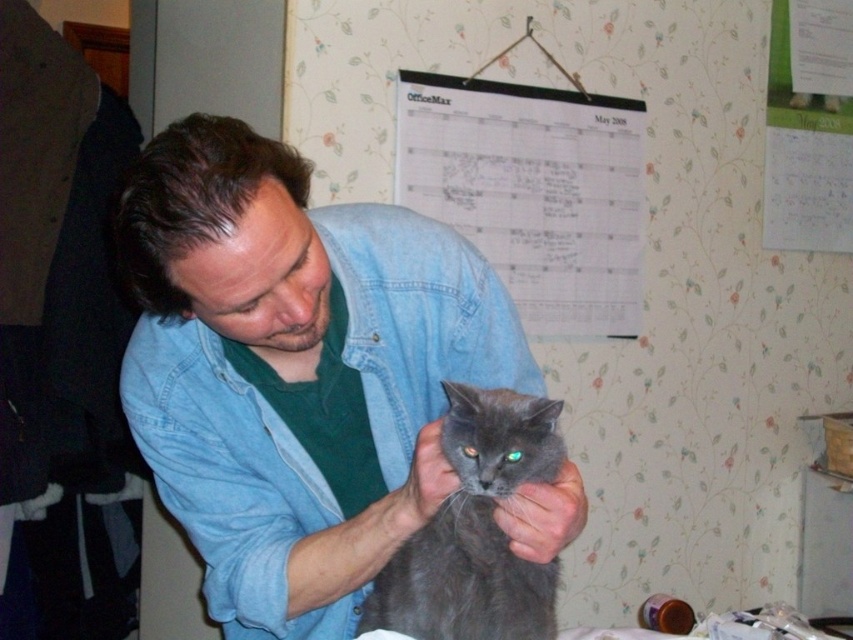
Question: Does fuzzy gray cat at center appear on the right side of gray fluffy cat at center?

Choices:
 (A) no
 (B) yes

Answer: (A)

Question: Can you confirm if faded denim jacket at center is positioned to the left of fuzzy gray cat at center?

Choices:
 (A) no
 (B) yes

Answer: (A)

Question: Which object appears farthest from the camera in this image?

Choices:
 (A) faded denim jacket at center
 (B) gray fluffy cat at center
 (C) fuzzy gray cat at center

Answer: (C)

Question: Which point is closer to the camera?

Choices:
 (A) gray fluffy cat at center
 (B) fuzzy gray cat at center
 (C) faded denim jacket at center

Answer: (A)

Question: Among these points, which one is nearest to the camera?

Choices:
 (A) (442, 560)
 (B) (0, 164)
 (C) (451, 298)

Answer: (A)

Question: Is fuzzy gray cat at center wider than gray fluffy cat at center?

Choices:
 (A) yes
 (B) no

Answer: (A)